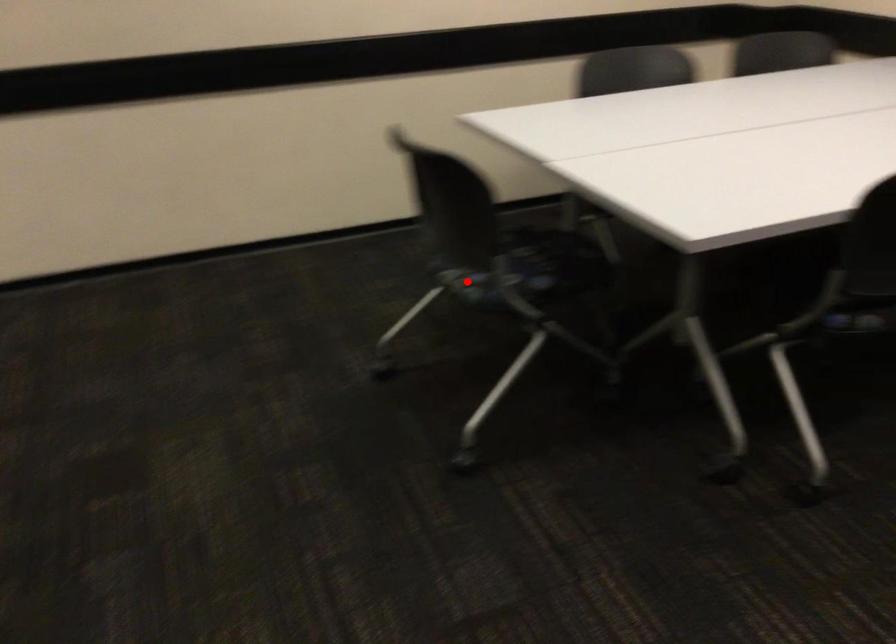
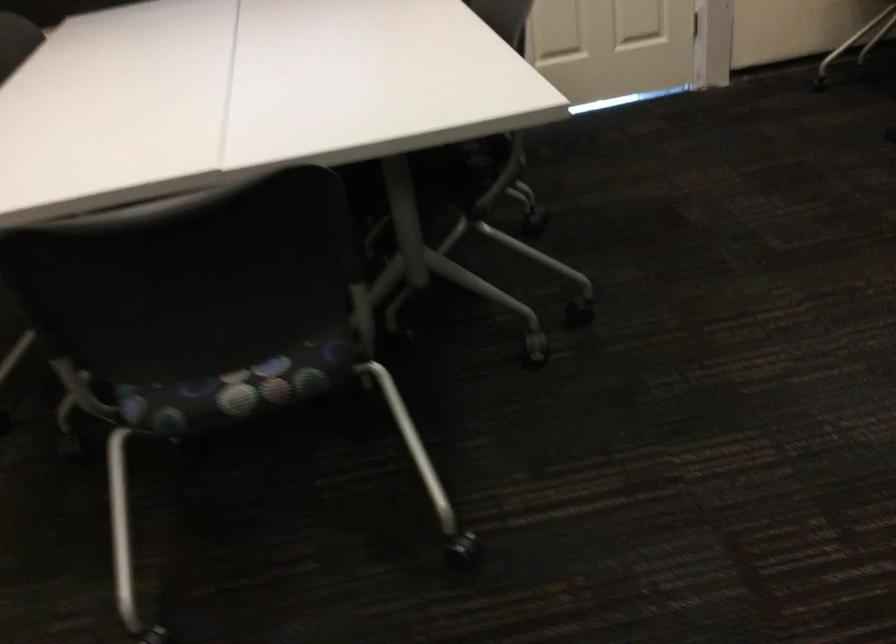
Where in the second image is the point corresponding to the highlighted location from the first image?

(234, 389)